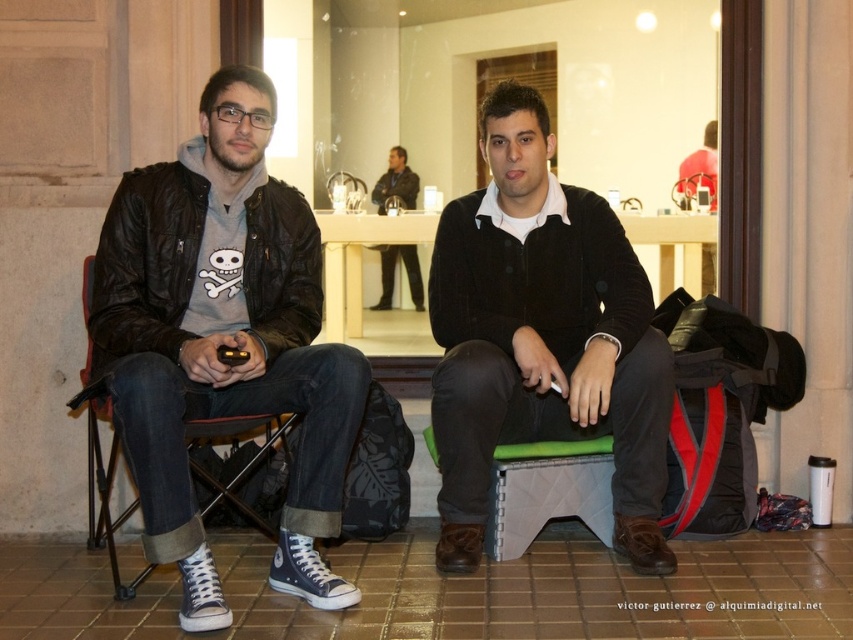
You are standing in a public space and see two people. The person on the left is wearing a black leather jacket over a gray hoodie with a skull and crossbones graphic. The person on the right is wearing the dark brown sweater at center. If you want to approach the person on the right, which direction should you move relative to the person on the left?

To approach the person on the right wearing the dark brown sweater at center, you should move to the right side of the person on the left.

You are a photographer setting up a shoot in this scene. You need to position a backdrop that must be taller than both the matte black jacket at left and the dark brown sweater at center. Based on their heights, what is the minimum height the backdrop should be?

The matte black jacket at left is taller than the dark brown sweater at center. To ensure the backdrop is taller than both, the minimum height should be just over the height of the matte black jacket at left.

You are a photographer trying to capture a photo of both the dark brown sweater at center and the green fabric stool at lower center. Since you want both objects to be clearly visible in the photo, which one should you focus on first to ensure proper focus?

You should focus on the dark brown sweater at center first because it is taller than the green fabric stool at lower center, so focusing on the taller object first ensures that the depth of field captures both objects clearly.